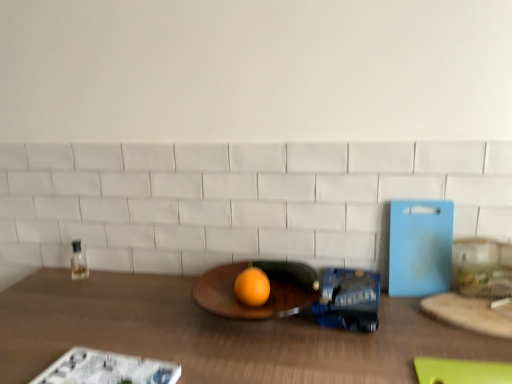
In order to click on free spot above wooden cutting board at right (from a real-world perspective) in this screenshot , I will do `click(481, 301)`.